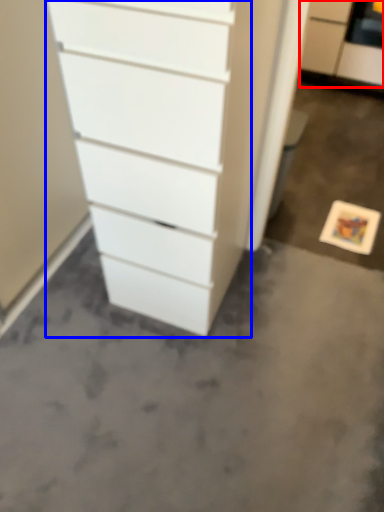
Question: Which point is further to the camera, filing cabinet (highlighted by a red box) or chest of drawers (highlighted by a blue box)?

Choices:
 (A) filing cabinet
 (B) chest of drawers

Answer: (A)